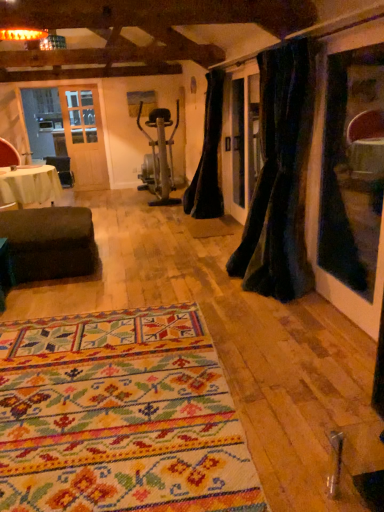
Question: In terms of height, does multicolored woven rug at center look taller or shorter compared to velvet dark green curtain at right, the 2th curtain positioned from the back?

Choices:
 (A) tall
 (B) short

Answer: (B)

Question: Relative to velvet dark green curtain at right, which appears as the 1th curtain when viewed from the right, is multicolored woven rug at center in front or behind?

Choices:
 (A) front
 (B) behind

Answer: (A)

Question: Based on their relative distances, which object is nearer to the velvet dark green curtain at right, arranged as the first curtain when viewed from the front?

Choices:
 (A) red leather armchair at left
 (B) dark brown fabric ottoman at lower left
 (C) multicolored woven rug at center
 (D) black velvet curtain at center, the first curtain positioned from the left
 (E) white fabric-covered table at left

Answer: (C)

Question: Which object is the closest to the black velvet curtain at center, arranged as the 1th curtain when viewed from the back?

Choices:
 (A) dark brown fabric ottoman at lower left
 (B) red leather armchair at left
 (C) white fabric-covered table at left
 (D) multicolored woven rug at center
 (E) velvet dark green curtain at right, the 2th curtain positioned from the back

Answer: (E)